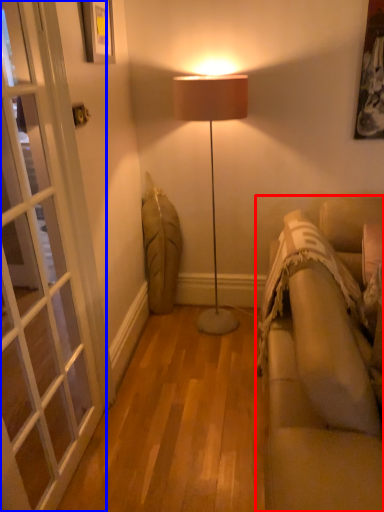
Question: Which point is closer to the camera, studio couch (highlighted by a red box) or screen door (highlighted by a blue box)?

Choices:
 (A) studio couch
 (B) screen door

Answer: (A)